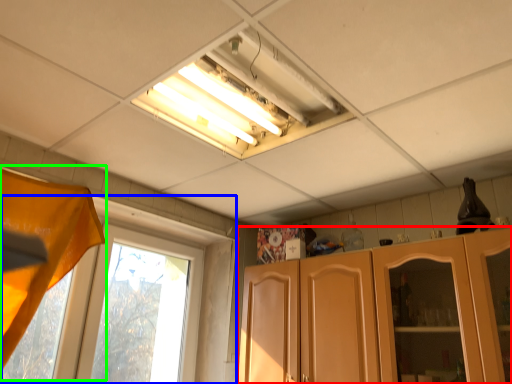
Question: Which object is positioned closest to cabinetry (highlighted by a red box)? Select from window (highlighted by a blue box) and curtain (highlighted by a green box).

Choices:
 (A) window
 (B) curtain

Answer: (A)